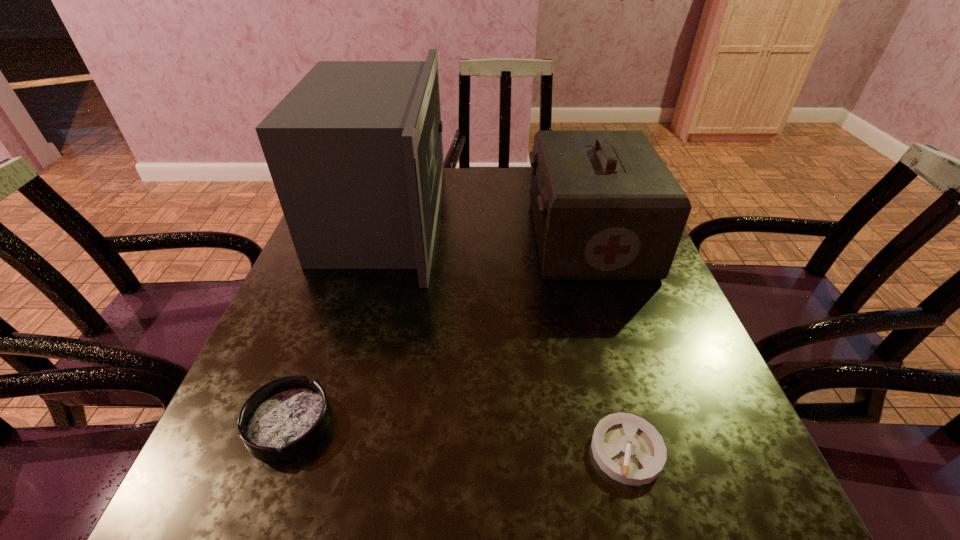
You are a GUI agent. You are given a task and a screenshot of the screen. Output one action in this format:
    pyautogui.click(x=<x>, y=<y>)
    Task: Click on the free space at the far edge of the desktop
    The height and width of the screenshot is (540, 960).
    Given the screenshot: What is the action you would take?
    pyautogui.click(x=509, y=174)

Where is `free space at the near edge of the desktop`? free space at the near edge of the desktop is located at coordinates (540, 524).

In the image, there is a desktop. Where is `vacant space at the left edge`? The image size is (960, 540). vacant space at the left edge is located at coordinates (310, 359).

Locate an element on the screen. The height and width of the screenshot is (540, 960). free space at the right edge is located at coordinates (693, 433).

In the image, there is a desktop. Where is `vacant region at the near right corner`? The image size is (960, 540). vacant region at the near right corner is located at coordinates (680, 478).

You are a GUI agent. You are given a task and a screenshot of the screen. Output one action in this format:
    pyautogui.click(x=<x>, y=<y>)
    Task: Click on the vacant area that lies between the shortest object and the second tallest object
    The height and width of the screenshot is (540, 960).
    Given the screenshot: What is the action you would take?
    coord(608,344)

Locate an element on the screen. This screenshot has width=960, height=540. free space between the third shortest object and the microwave oven is located at coordinates (486, 228).

Locate an element on the screen. unoccupied area between the taller ashtray and the tallest object is located at coordinates (336, 320).

Where is `free spot between the third shortest object and the tallest object`? The height and width of the screenshot is (540, 960). free spot between the third shortest object and the tallest object is located at coordinates pyautogui.click(x=486, y=228).

Where is `free area in between the shortest object and the microwave oven`? free area in between the shortest object and the microwave oven is located at coordinates (505, 334).